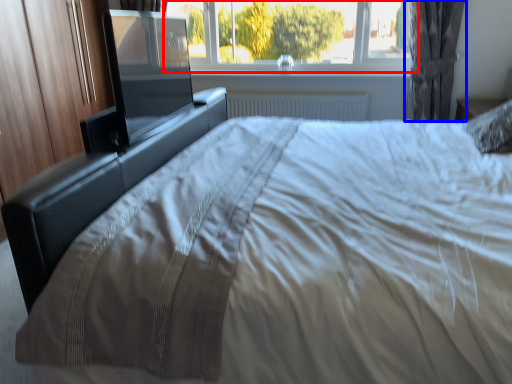
Question: Among these objects, which one is farthest to the camera, window (highlighted by a red box) or curtain (highlighted by a blue box)?

Choices:
 (A) window
 (B) curtain

Answer: (A)